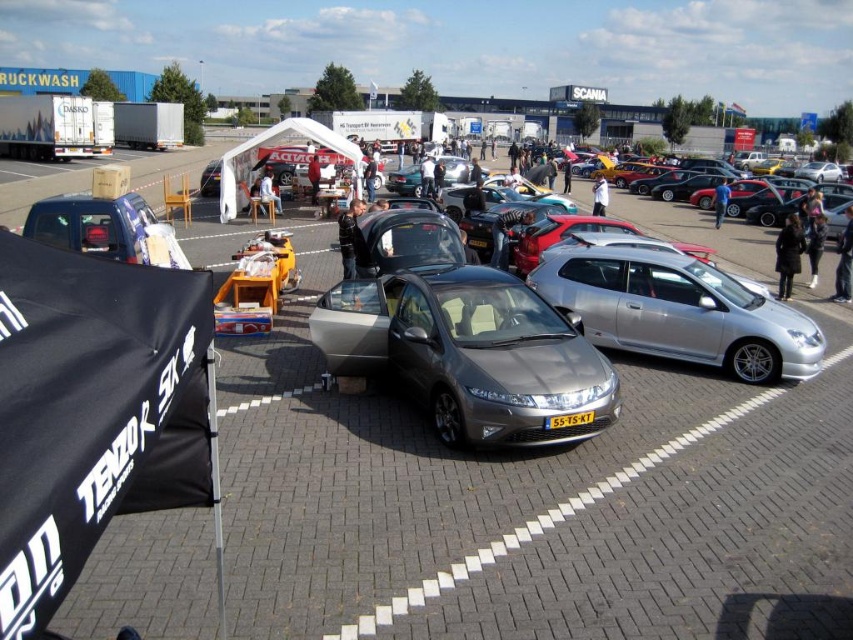
You are standing at the entrance of the car meet and want to find the dark gray jacket at center. According to the coordinates provided, where should you look relative to the image frame?

The dark gray jacket at center is located at the 2D coordinates point 0.372 on the x axis and 0.410 on the y axis relative to the image frame.

You are standing at the car meet and want to take a photo of both the point at location [584,412] and the point at [428,166]. Which point should you focus on first to ensure both are in clear view?

You should focus on point [584,412] first because it is closer to the camera than point [428,166], ensuring both points are in clear view.